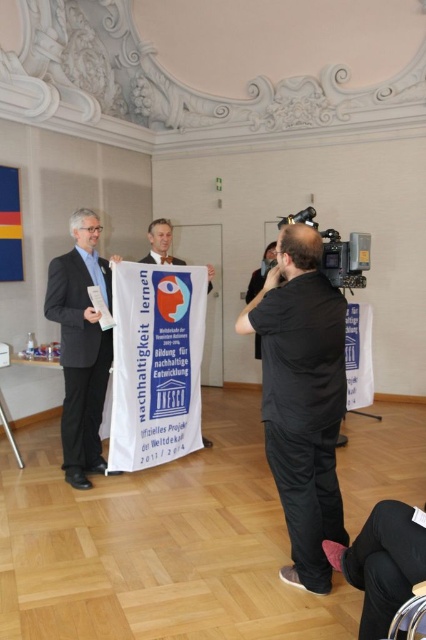
Question: Which of the following is the farthest from the observer?

Choices:
 (A) (324, 592)
 (B) (80, 349)

Answer: (B)

Question: Considering the relative positions of black matte shirt at center and matte black suit at left in the image provided, where is black matte shirt at center located with respect to matte black suit at left?

Choices:
 (A) left
 (B) right

Answer: (B)

Question: Considering the relative positions of black matte shirt at center and matte black suit at left in the image provided, where is black matte shirt at center located with respect to matte black suit at left?

Choices:
 (A) above
 (B) below

Answer: (B)

Question: Which point is closer to the camera?

Choices:
 (A) (83, 316)
 (B) (305, 385)

Answer: (B)

Question: Which object is farther from the camera taking this photo?

Choices:
 (A) matte black suit at left
 (B) black matte shirt at center

Answer: (A)

Question: Does black matte shirt at center have a lesser width compared to matte black suit at left?

Choices:
 (A) yes
 (B) no

Answer: (B)